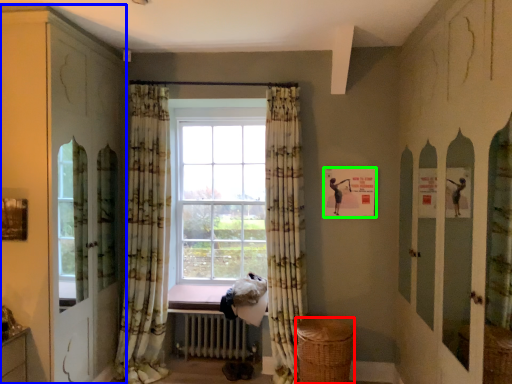
Question: Which is farther away from basket (highlighted by a red box)? dresser (highlighted by a blue box) or picture frame (highlighted by a green box)?

Choices:
 (A) dresser
 (B) picture frame

Answer: (A)